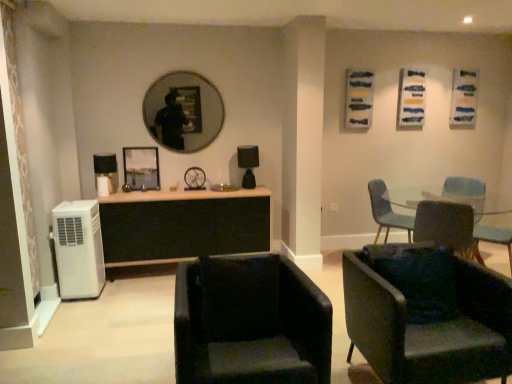
Identify the location of free point in front of black wood cabinet at center. point(122,325).